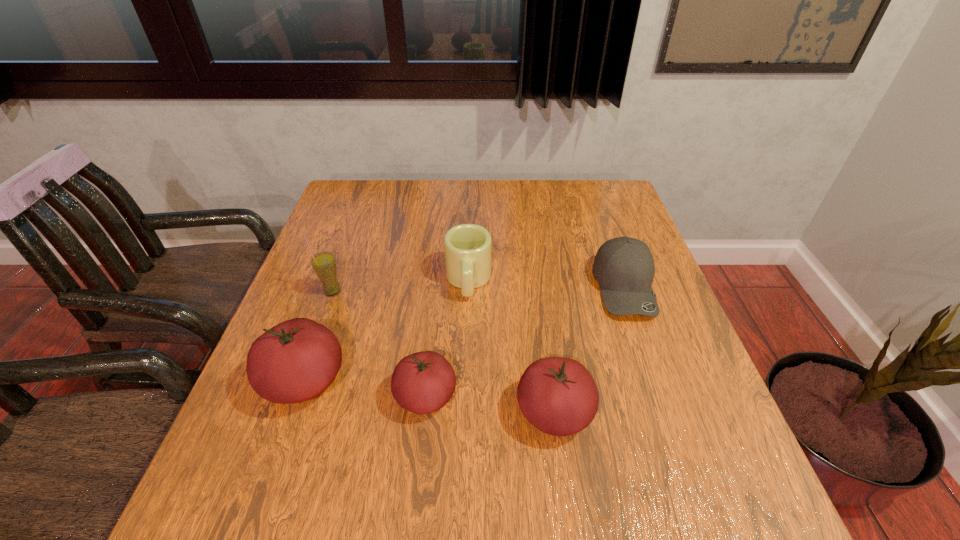
This screenshot has height=540, width=960. Identify the location of vacant area at the right edge of the desktop. (675, 390).

Locate an element on the screen. vacant space at the far left corner is located at coordinates (338, 199).

Image resolution: width=960 pixels, height=540 pixels. In order to click on vacant area at the far right corner of the desktop in this screenshot , I will do `click(616, 203)`.

Locate an element on the screen. The height and width of the screenshot is (540, 960). unoccupied position between the straw for drinking and the second tomato from right to left is located at coordinates (379, 344).

I want to click on free space between the second tomato from left to right and the leftmost tomato, so click(x=365, y=389).

Find the location of a particular element. vacant space in between the rightmost tomato and the mug is located at coordinates (512, 347).

Locate an element on the screen. The image size is (960, 540). vacant space in between the leftmost tomato and the second tomato from left to right is located at coordinates (365, 389).

Where is `vacant point located between the rightmost object and the second object from right to left`? vacant point located between the rightmost object and the second object from right to left is located at coordinates (590, 349).

Locate an element on the screen. The width and height of the screenshot is (960, 540). unoccupied area between the rightmost tomato and the rightmost object is located at coordinates (590, 349).

At what (x,y) coordinates should I click in order to perform the action: click on unoccupied area between the rightmost object and the straw for drinking. Please return your answer as a coordinate pair (x, y). The width and height of the screenshot is (960, 540). Looking at the image, I should click on (479, 289).